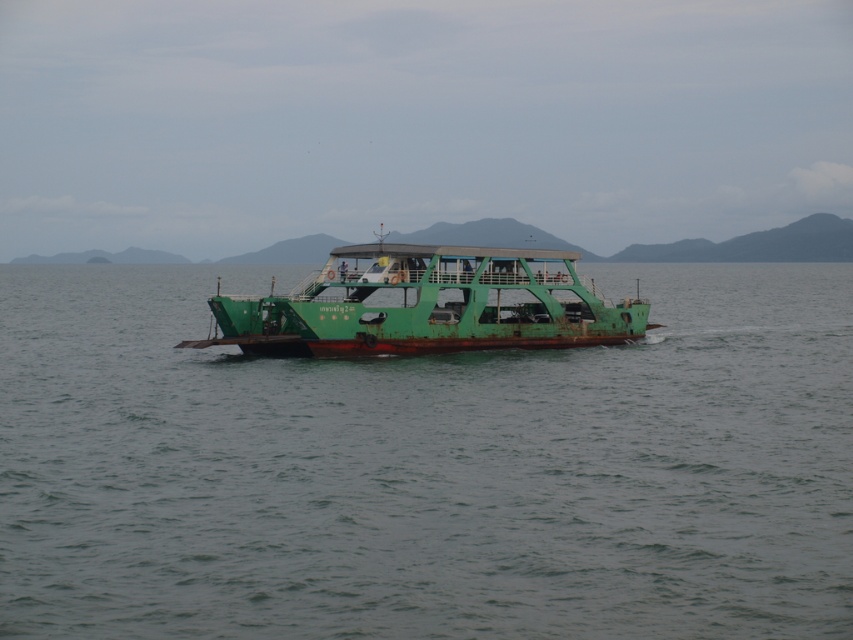
You are a passenger on the ferry and want to take a photo of the green matte boat at center from the green matte water at center. Is this possible given their positions?

The green matte water at center is located above the green matte boat at center, so you can take a photo of the green matte boat at center from the green matte water at center by positioning yourself where the water is above the boat.

You are standing on the ferry boat and want to take a photo. You notice two points marked on the deck, point (44, 396) and point (257, 321). Which point will appear larger in your photo?

Point (44, 396) is closer to the camera than point (257, 321), so it will appear larger in the photo.

You are standing on the deck of the ferry and looking towards the front. Which object, the green matte water at center or the green matte boat at center, would you see first?

The green matte water at center is in front of the green matte boat at center, so you would see the green matte water at center first.